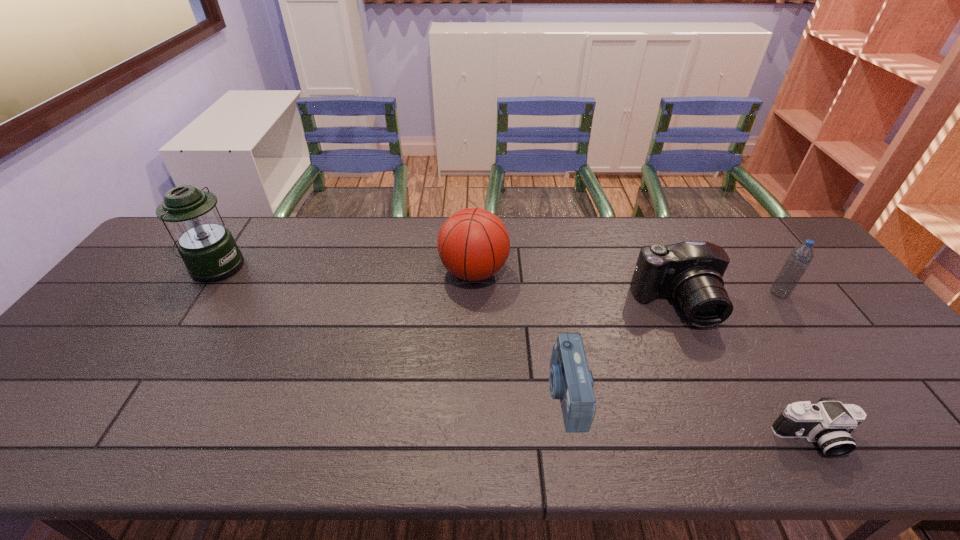
Locate an element on the screen. free space that is in between the tallest camera and the leftmost camera is located at coordinates (621, 349).

You are a GUI agent. You are given a task and a screenshot of the screen. Output one action in this format:
    pyautogui.click(x=<x>, y=<y>)
    Task: Click on the object that is the closest one to the farthest camera
    This screenshot has height=540, width=960.
    Given the screenshot: What is the action you would take?
    pyautogui.click(x=801, y=256)

Image resolution: width=960 pixels, height=540 pixels. What are the coordinates of `object that is the second closest one to the basketball` in the screenshot? It's located at (690, 272).

Point out which camera is positioned as the nearest to the fourth object from right to left. Please provide its 2D coordinates. Your answer should be formatted as a tuple, i.e. [(x, y)], where the tuple contains the x and y coordinates of a point satisfying the conditions above.

[(690, 272)]

The width and height of the screenshot is (960, 540). I want to click on camera that is the third closest one to the rightmost object, so click(570, 380).

The image size is (960, 540). In order to click on vacant area in the image that satisfies the following two spatial constraints: 1. on the front side of the rightmost object; 2. on the lens of the leftmost camera in this screenshot , I will do `click(851, 393)`.